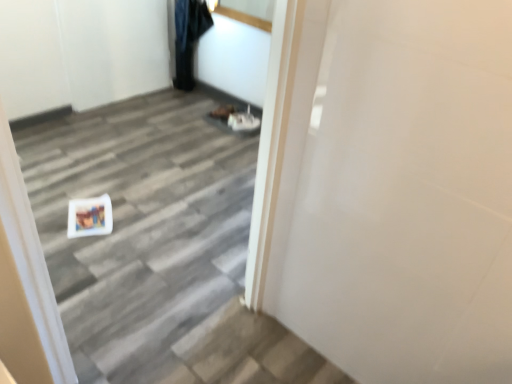
I want to click on vacant space to the left of white glossy door at center, so click(x=106, y=324).